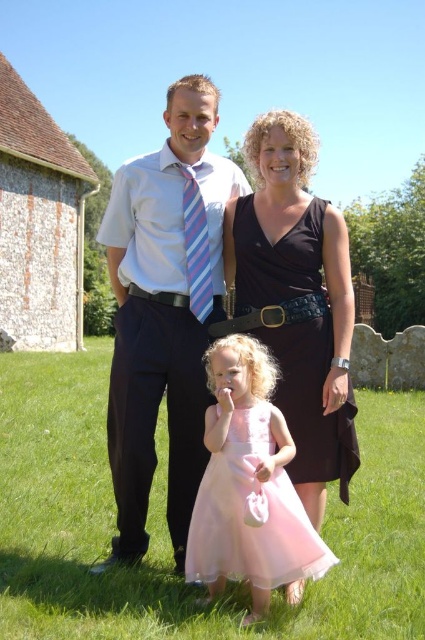
You are a photographer setting up a camera to capture the family in the scene. You need to ensure that both the white shirt at center and the striped fabric tie at center are clearly visible. Given their sizes, which object should you focus on to ensure proper framing?

The white shirt at center has a larger width than the striped fabric tie at center, so focusing on the white shirt at center would ensure proper framing as it occupies more space in the composition.

You are a photographer trying to capture the family photo. You notice the white shirt at center and the striped fabric tie at center. Which object should you focus on first if you want to follow the left to right reading order?

You should focus on the white shirt at center first because it is to the left of the striped fabric tie at center, following the left to right reading order.